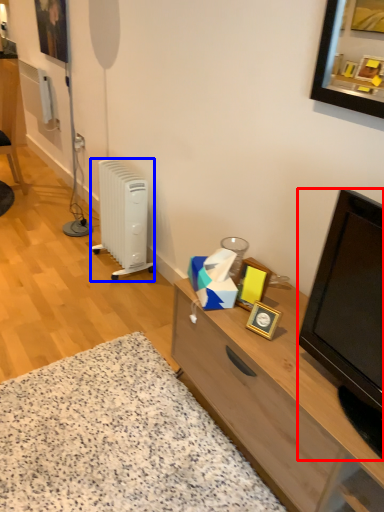
Question: Which object appears closest to the camera in this image, television (highlighted by a red box) or radiator (highlighted by a blue box)?

Choices:
 (A) television
 (B) radiator

Answer: (A)